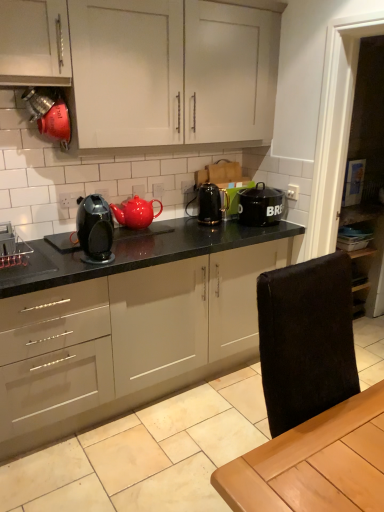
Question: Choose the correct answer: Is brushed metal spice rack at left, which is counted as the first appliance, starting from the front, inside matte black coffee maker at center or outside it?

Choices:
 (A) outside
 (B) inside

Answer: (A)

Question: Considering the relative positions of brushed metal spice rack at left, which ranks as the first appliance in left-to-right order, and matte black coffee maker at center in the image provided, is brushed metal spice rack at left, which ranks as the first appliance in left-to-right order, to the left or to the right of matte black coffee maker at center?

Choices:
 (A) right
 (B) left

Answer: (B)

Question: Which of these objects is positioned closest to the brushed metal spice rack at left, which ranks as the first appliance in left-to-right order?

Choices:
 (A) black granite countertop at center
 (B) glossy ceramic teapot at center, the first kitchen appliance in the left-to-right sequence
 (C) matte black coffee maker at center
 (D) white matte cabinet at upper center
 (E) black glossy electric kettle at center, which is the second appliance from left to right

Answer: (C)

Question: Which object is the farthest from the white matte cabinet at upper center?

Choices:
 (A) matte black coffee maker at center
 (B) black granite countertop at center
 (C) black glossy electric kettle at center, arranged as the first appliance when viewed from the top
 (D) brushed metal spice rack at left, marked as the second appliance in a right-to-left arrangement
 (E) black matte pot at center, placed as the first kitchen appliance when sorted from right to left

Answer: (D)